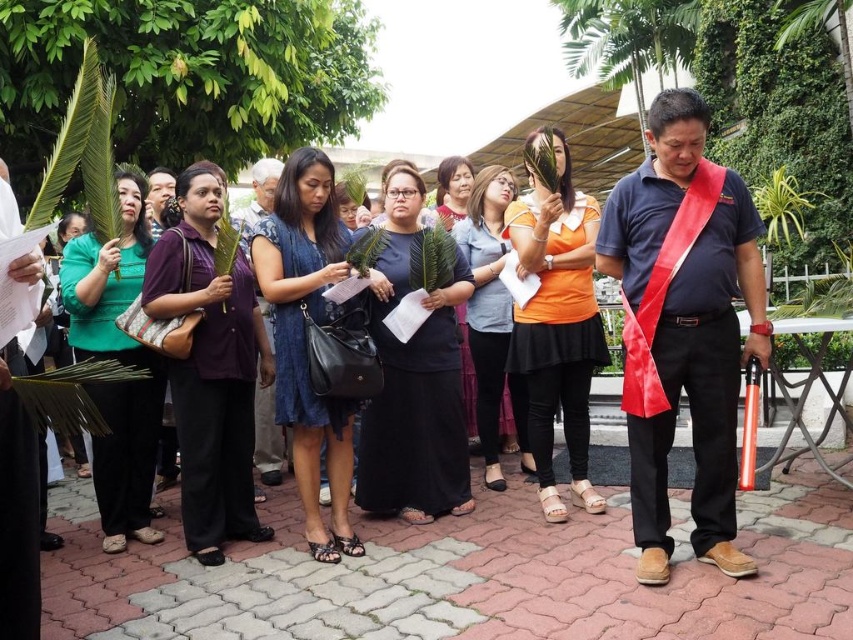
You are organizing a photo shoot and want to ensure the blue denim dress at center and the matte gray dress at center are arranged symmetrically. Which dress should be moved to the right to achieve symmetry?

The blue denim dress at center should be moved to the right to align it with the matte gray dress at center since it is currently on the left side of the latter.

You are standing in the courtyard and see two points marked in the scene. The first point is at coordinates point (387,307) and the second is at point (126,474). Which point is closer to you?

Point (387,307) is in front of point (126,474), so it is closer to you.

You are a photographer trying to capture the black matte dress at center and the matte purple dress at center in a single frame. Which dress should you focus on to ensure both are visible in the photo?

The black matte dress at center is positioned over the matte purple dress at center, so focusing on the black matte dress at center will ensure both are visible as it is in front.